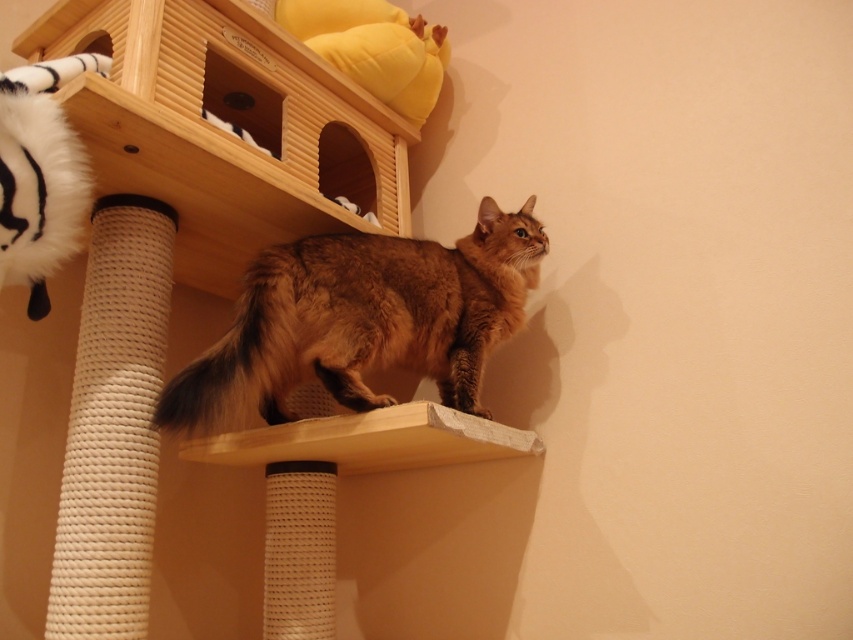
You are a cat owner who wants to place a small toy on the white textured scratching post at left. The toy is 1 foot in diameter. Can the toy fit on the post?

The white textured scratching post at left is 3.40 feet from viewer, so the toy can fit on the post since its diameter is smaller than the post height.